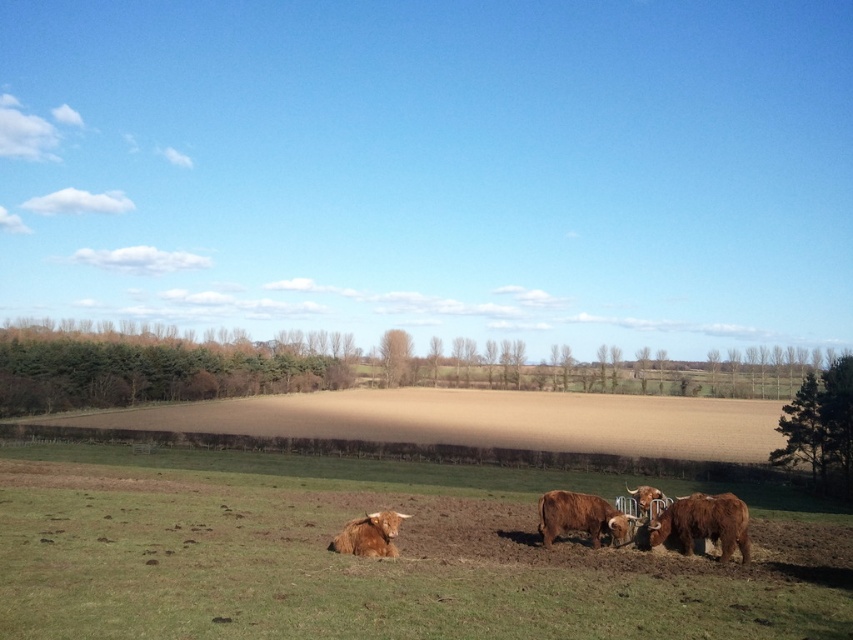
You are a farmer checking the health of your cattle. You notice that the brown furry bull at lower right and the brown furry bull at center are both in the field. Which bull should you prioritize examining if you want to check the smaller one first?

The brown furry bull at lower right has a lesser height compared to the brown furry bull at center, so you should prioritize examining the brown furry bull at lower right first.

You are standing at the origin point of the image coordinate system. You want to walk to the brown soil at center. Which direction should you move in terms of x and y coordinates?

The brown soil at center is located at coordinates x 0.658 and y 0.557, so you should move in the positive x and positive y direction to reach it.